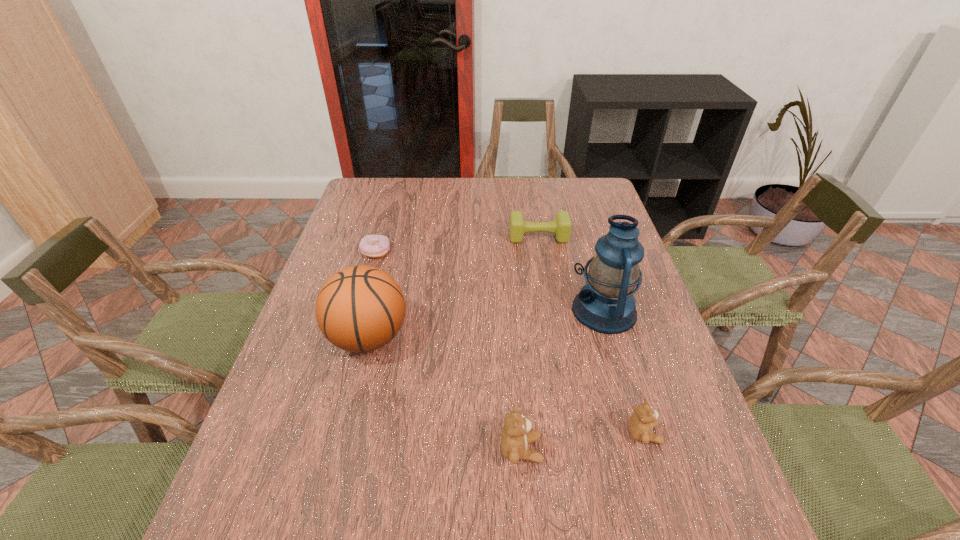
Where is `object at the near right corner`? The image size is (960, 540). object at the near right corner is located at coordinates (643, 420).

In the image, there is a desktop. Where is `vacant space at the far edge`? This screenshot has height=540, width=960. vacant space at the far edge is located at coordinates (487, 182).

At what (x,y) coordinates should I click in order to perform the action: click on vacant area at the left edge of the desktop. Please return your answer as a coordinate pair (x, y). The width and height of the screenshot is (960, 540). Looking at the image, I should click on [x=333, y=433].

Where is `vacant space at the right edge of the desktop`? The width and height of the screenshot is (960, 540). vacant space at the right edge of the desktop is located at coordinates (570, 218).

I want to click on vacant area at the near right corner of the desktop, so click(634, 457).

You are a GUI agent. You are given a task and a screenshot of the screen. Output one action in this format:
    pyautogui.click(x=<x>, y=<y>)
    Task: Click on the free area in between the third tallest object and the second tallest object
    The image size is (960, 540).
    Given the screenshot: What is the action you would take?
    click(x=444, y=393)

Locate an element on the screen. vacant space that is in between the tallest object and the shortest object is located at coordinates (491, 281).

Locate an element on the screen. vacant region between the basketball and the dumbbell is located at coordinates (453, 287).

What are the coordinates of `vacant region between the shortest object and the left teddy bear` in the screenshot? It's located at (x=448, y=350).

Identify the location of vacant space that's between the lantern and the basketball. The height and width of the screenshot is (540, 960). (486, 323).